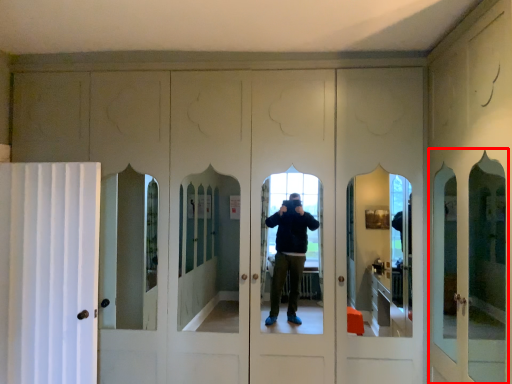
Question: Observing the image, what is the correct spatial positioning of screen door (annotated by the red box) in reference to curtain?

Choices:
 (A) right
 (B) left

Answer: (A)